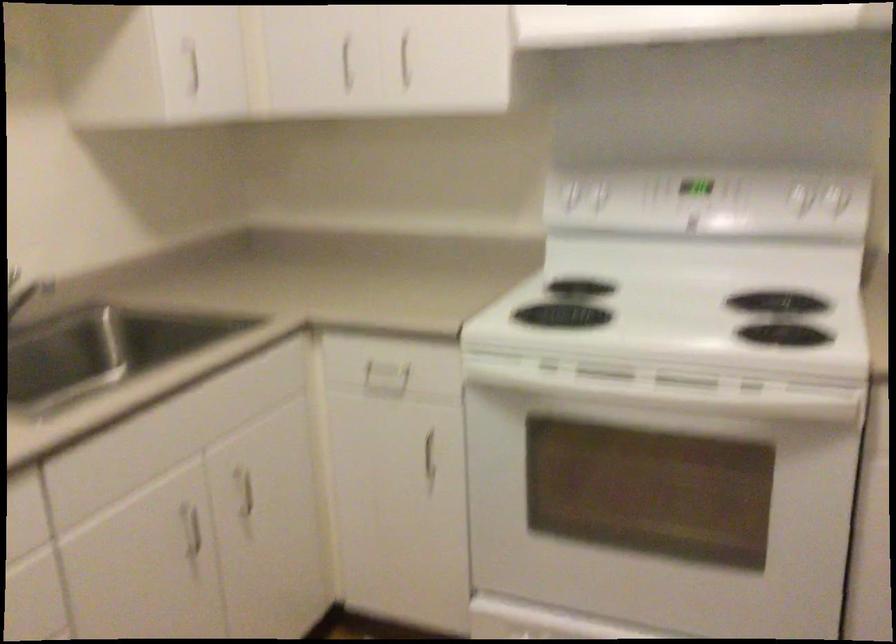
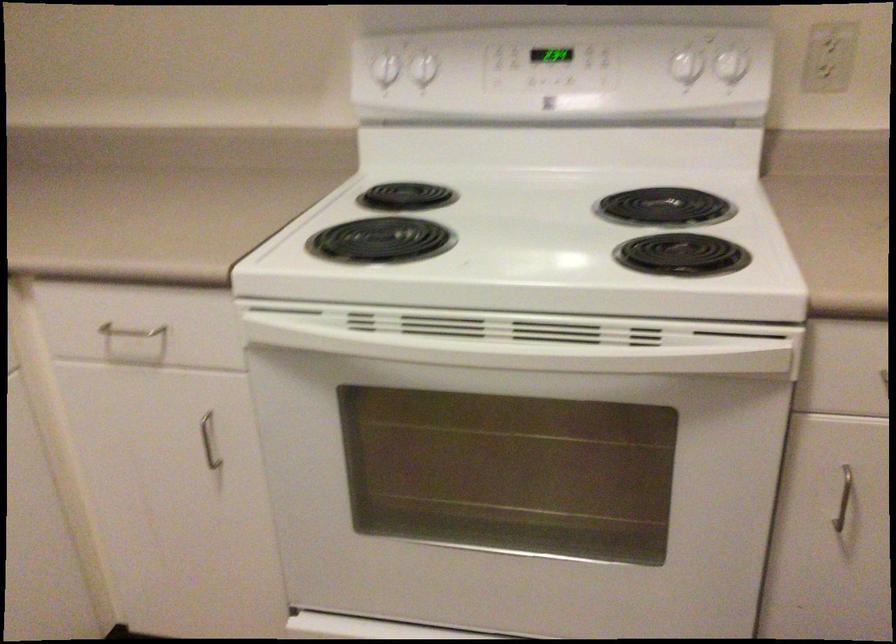
Where in the second image is the point corresponding to pixel 670 386 from the first image?

(526, 339)